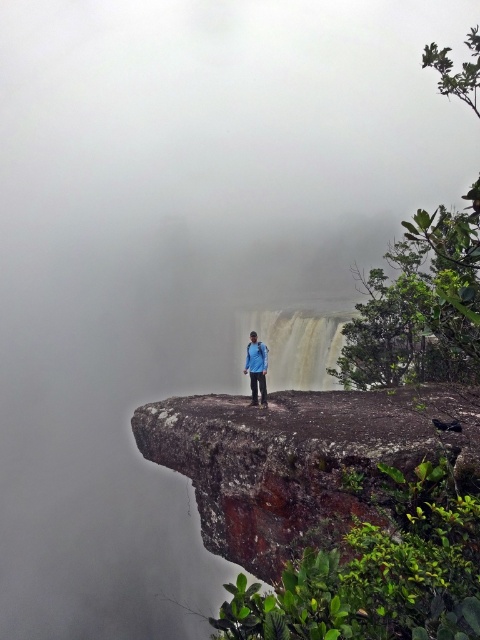
Question: Can you confirm if rusty rock cliff at center is positioned below smooth white waterfall at center?

Choices:
 (A) no
 (B) yes

Answer: (B)

Question: Which object is farther from the camera taking this photo?

Choices:
 (A) blue fabric jacket at center
 (B) smooth white waterfall at center
 (C) rusty rock cliff at center

Answer: (B)

Question: Does rusty rock cliff at center appear on the left side of smooth white waterfall at center?

Choices:
 (A) no
 (B) yes

Answer: (B)

Question: Is rusty rock cliff at center above smooth white waterfall at center?

Choices:
 (A) no
 (B) yes

Answer: (A)

Question: Among these objects, which one is farthest from the camera?

Choices:
 (A) blue fabric jacket at center
 (B) rusty rock cliff at center

Answer: (A)

Question: Among these objects, which one is nearest to the camera?

Choices:
 (A) smooth white waterfall at center
 (B) blue fabric jacket at center

Answer: (B)